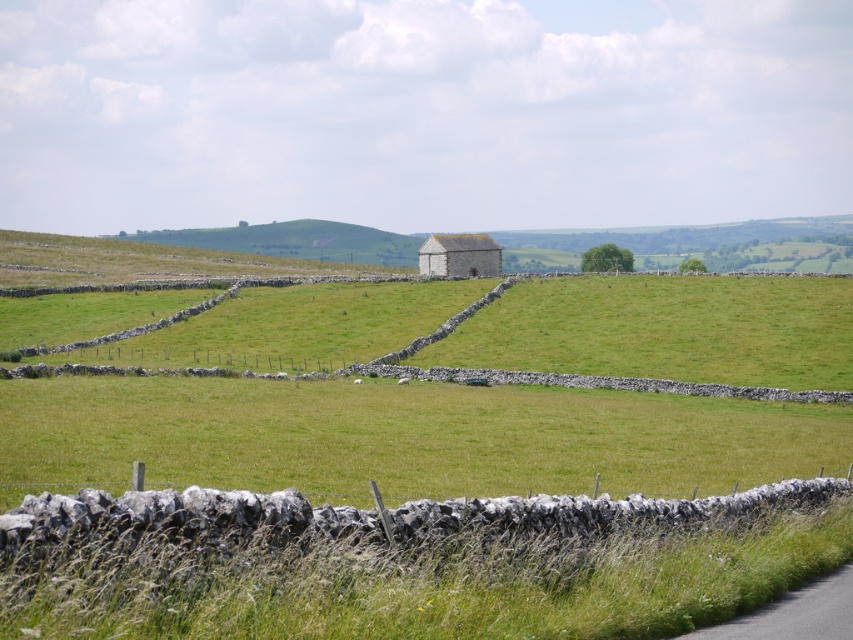
From the picture: Who is shorter, green grass at center or white stone barn at center?

With less height is white stone barn at center.

Between green grass at center and white stone barn at center, which one appears on the right side from the viewer's perspective?

green grass at center is more to the right.

Identify the location of green grass at center. (399, 438).

The height and width of the screenshot is (640, 853). Identify the location of green grass at center. (399, 438).